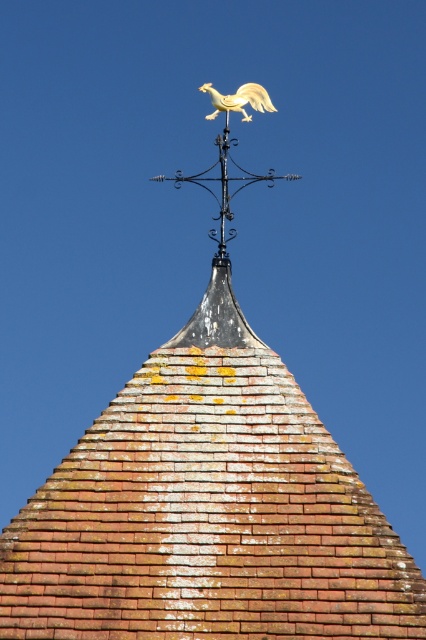
Question: Can you confirm if gold matte rooster at upper center is positioned above gold polished rooster at upper center?

Choices:
 (A) no
 (B) yes

Answer: (A)

Question: Can you confirm if gold matte rooster at upper center is positioned below gold polished rooster at upper center?

Choices:
 (A) yes
 (B) no

Answer: (A)

Question: Which object is farther from the camera taking this photo?

Choices:
 (A) gold matte rooster at upper center
 (B) gold polished rooster at upper center

Answer: (B)

Question: Which point is closer to the camera taking this photo?

Choices:
 (A) (213, 93)
 (B) (195, 173)

Answer: (A)

Question: Can you confirm if gold matte rooster at upper center is smaller than gold polished rooster at upper center?

Choices:
 (A) yes
 (B) no

Answer: (B)